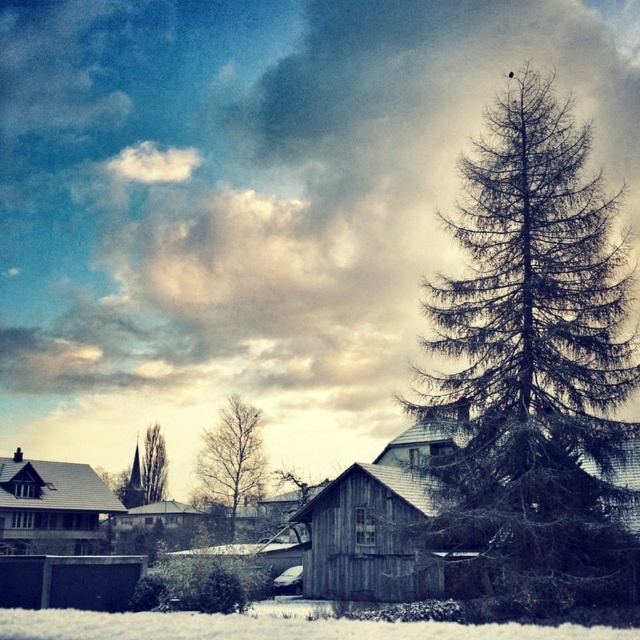
Question: Among these objects, which one is farthest from the camera?

Choices:
 (A) wooden shack at center
 (B) wooden hut at center

Answer: (B)

Question: Which point is farther to the camera?

Choices:
 (A) (260, 465)
 (B) (186, 522)
 (C) (150, 492)

Answer: (C)

Question: Does wooden hut at left appear on the left side of green matte tree at center-left?

Choices:
 (A) no
 (B) yes

Answer: (B)

Question: Can you confirm if dark green textured pine tree at right is positioned below bare branches at center?

Choices:
 (A) yes
 (B) no

Answer: (B)

Question: Does bare branches at center appear over green matte tree at center-left?

Choices:
 (A) no
 (B) yes

Answer: (B)

Question: Which of these objects is positioned farthest from the wooden hut at center?

Choices:
 (A) wooden hut at left
 (B) wooden shack at center
 (C) bare branches at center

Answer: (B)